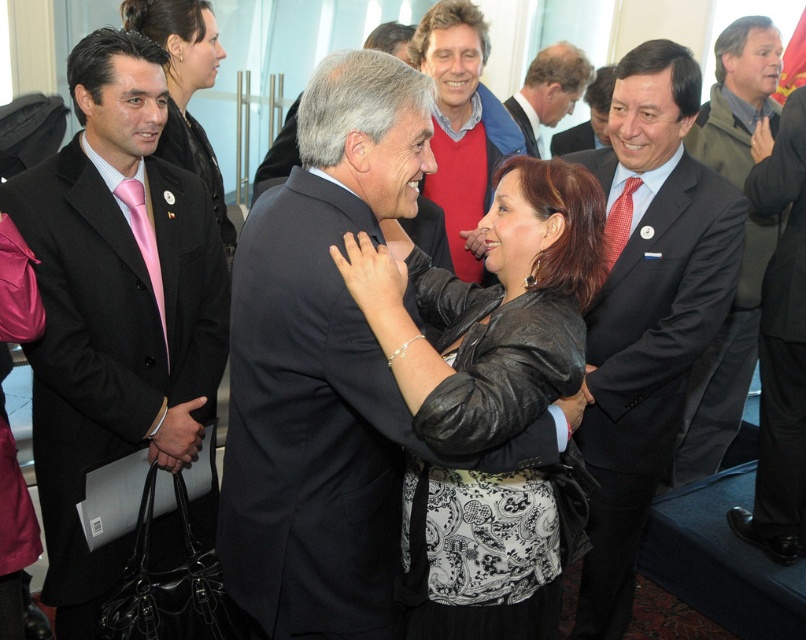
You are attending a formal event and notice two attendees dressed in black attire. The first is wearing a matte black suit at left, and the second is wearing a black leather jacket at center. Based on their positions, which one is closer to the entrance of the room?

The matte black suit at left is positioned over the black leather jacket at center, so the matte black suit at left is closer to the entrance since it is in front of the other person.

You are a photographer at the event and want to capture a photo that includes both the black leather jacket at center and the green woolen sweater at upper right. Which object should you focus on first to ensure both are in clear view?

You should focus on the black leather jacket at center first since it is closer to the viewer than the green woolen sweater at upper right, ensuring both are in clear focus when using depth of field.